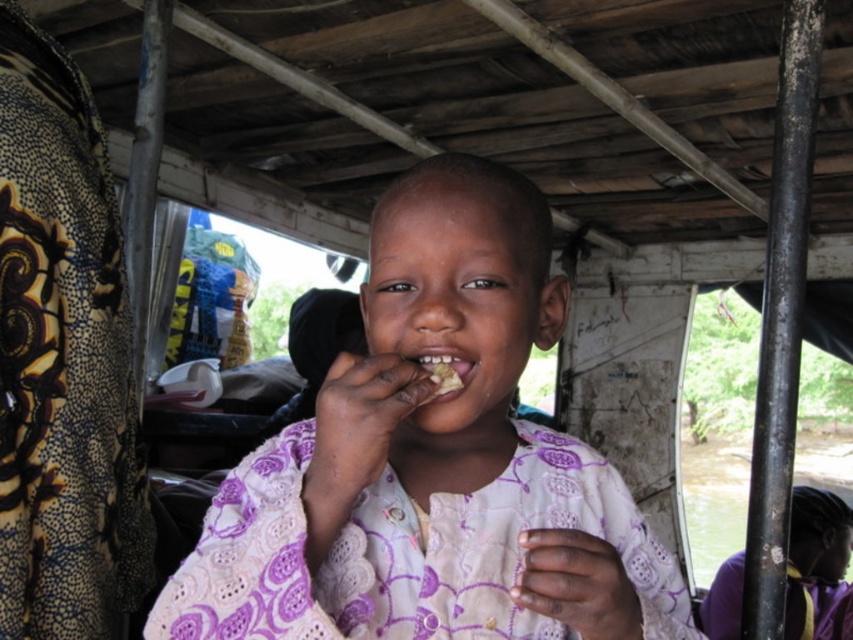
Question: Can you confirm if purple fabric at lower right is wider than white crumbly food at mouth?

Choices:
 (A) yes
 (B) no

Answer: (A)

Question: Estimate the real-world distances between objects in this image. Which object is farther from the white crumbly food at mouth?

Choices:
 (A) yellowish matte food at center
 (B) purple fabric at lower right

Answer: (B)

Question: Among these objects, which one is nearest to the camera?

Choices:
 (A) white crumbly food at mouth
 (B) purple lace shirt at center
 (C) yellowish matte food at center

Answer: (B)

Question: Based on their relative distances, which object is farther from the white crumbly food at mouth?

Choices:
 (A) purple lace shirt at center
 (B) purple fabric at lower right

Answer: (B)

Question: Can you confirm if purple lace shirt at center is bigger than white crumbly food at mouth?

Choices:
 (A) yes
 (B) no

Answer: (A)

Question: From the image, what is the correct spatial relationship of purple lace shirt at center in relation to white crumbly food at mouth?

Choices:
 (A) right
 (B) left

Answer: (B)